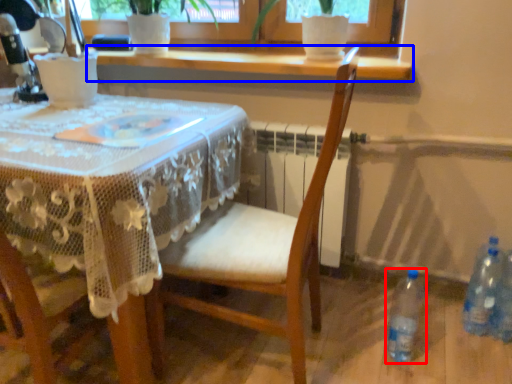
Question: Which point is closer to the camera, bottle (highlighted by a red box) or window sill (highlighted by a blue box)?

Choices:
 (A) bottle
 (B) window sill

Answer: (A)